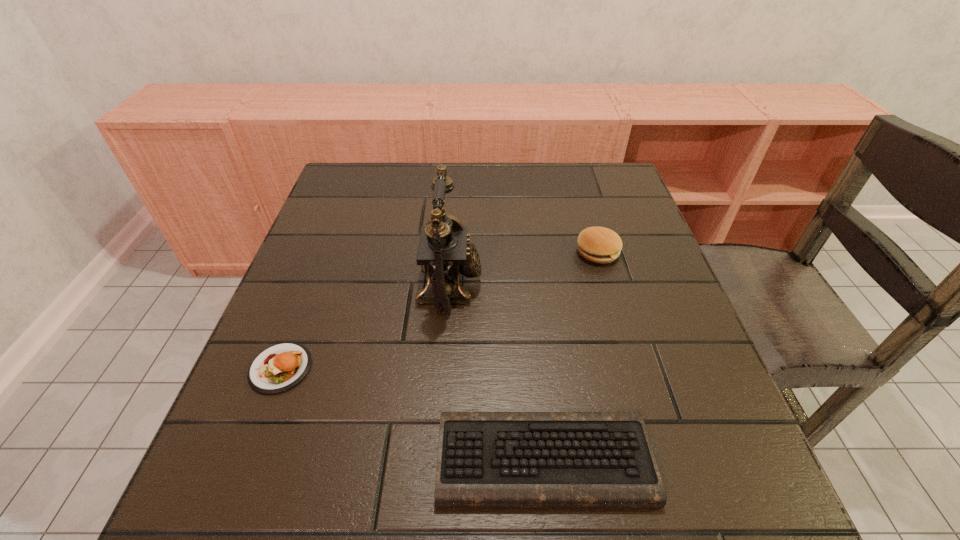
I want to click on object located in the near edge section of the desktop, so click(x=485, y=459).

The width and height of the screenshot is (960, 540). What are the coordinates of `object located at the left edge` in the screenshot? It's located at (280, 367).

Where is `patty located at the right edge`? This screenshot has height=540, width=960. patty located at the right edge is located at coordinates (601, 245).

Where is `computer keyboard that is at the right edge`? The height and width of the screenshot is (540, 960). computer keyboard that is at the right edge is located at coordinates (485, 459).

The image size is (960, 540). I want to click on object present at the near right corner, so click(x=485, y=459).

Image resolution: width=960 pixels, height=540 pixels. In the image, there is a desktop. In order to click on vacant space at the far edge in this screenshot , I will do `click(462, 191)`.

At what (x,y) coordinates should I click in order to perform the action: click on vacant space at the near edge of the desktop. Please return your answer as a coordinate pair (x, y). Image resolution: width=960 pixels, height=540 pixels. Looking at the image, I should click on (357, 500).

Locate an element on the screen. vacant space at the left edge of the desktop is located at coordinates (340, 355).

In the image, there is a desktop. What are the coordinates of `free space at the right edge` in the screenshot? It's located at (668, 368).

Locate an element on the screen. Image resolution: width=960 pixels, height=540 pixels. vacant space at the near left corner is located at coordinates (234, 471).